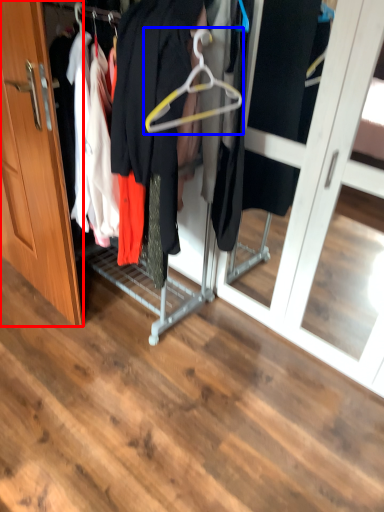
Question: Among these objects, which one is farthest to the camera, door (highlighted by a red box) or hanger (highlighted by a blue box)?

Choices:
 (A) door
 (B) hanger

Answer: (A)